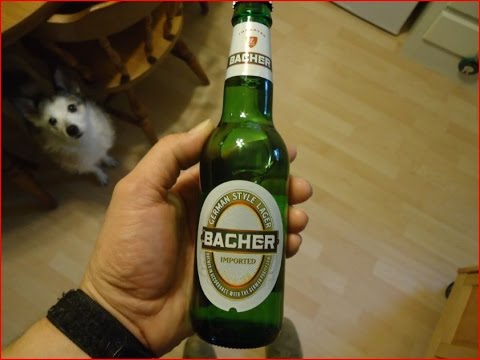
At what (x,y) coordinates should I click in order to perform the action: click on chair. Please return your answer as a coordinate pair (x, y). Looking at the image, I should click on (98, 21).